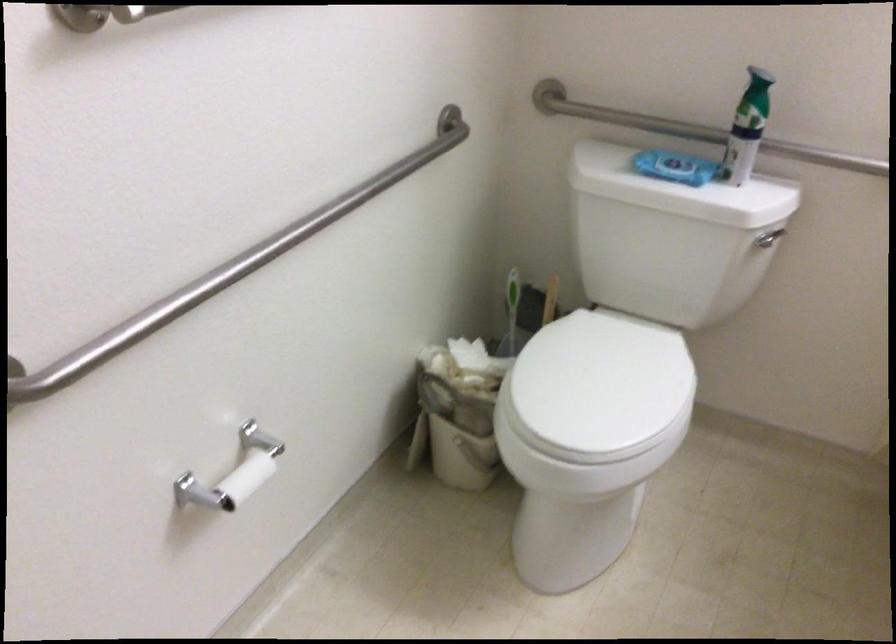
Identify the location of toilet paper roll. [245, 478].